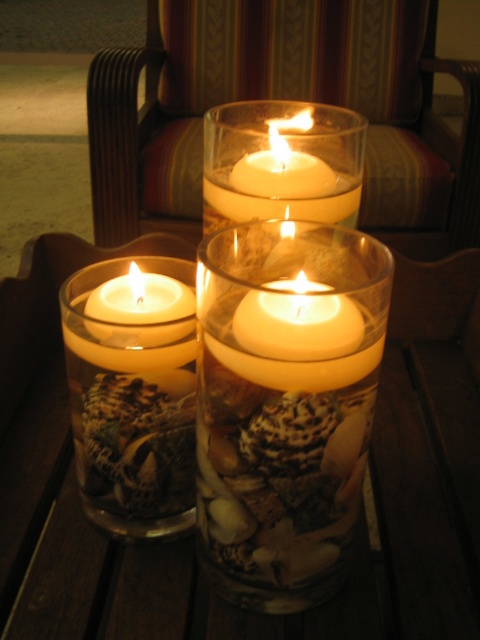
Does translucent glass candle at center appear over matte glass candle at left?

Incorrect, translucent glass candle at center is not positioned above matte glass candle at left.

Where is `translucent glass candle at center`? translucent glass candle at center is located at coordinates (192, 538).

Is point (123, 589) farther from viewer compared to point (194, 385)?

That is True.

The width and height of the screenshot is (480, 640). I want to click on translucent glass candle at center, so click(192, 538).

Who is more distant from viewer, (165, 522) or (134, 330)?

The point (165, 522) is behind.

Looking at this image, is matte glass candle at left positioned before matte white candle at left?

Yes, matte glass candle at left is in front of matte white candle at left.

Between point (108, 284) and point (179, 314), which one is positioned behind?

The point (108, 284) is more distant.

Locate an element on the screen. matte glass candle at left is located at coordinates (132, 394).

Measure the distance between translucent glass candle at center and camera.

A distance of 15.79 inches exists between translucent glass candle at center and camera.

Is translucent glass candle at center above matte white candle at left?

Incorrect, translucent glass candle at center is not positioned above matte white candle at left.

Where is `translucent glass candle at center`? translucent glass candle at center is located at coordinates (192, 538).

The width and height of the screenshot is (480, 640). I want to click on translucent glass candle at center, so click(192, 538).